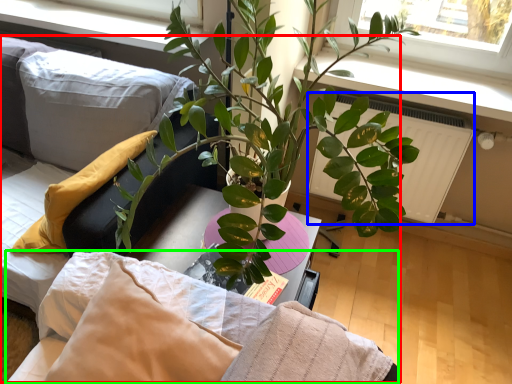
Question: Based on their relative distances, which object is farther from bed (highlighted by a red box)? Choose from radiator (highlighted by a blue box) and bedding (highlighted by a green box).

Choices:
 (A) radiator
 (B) bedding

Answer: (A)